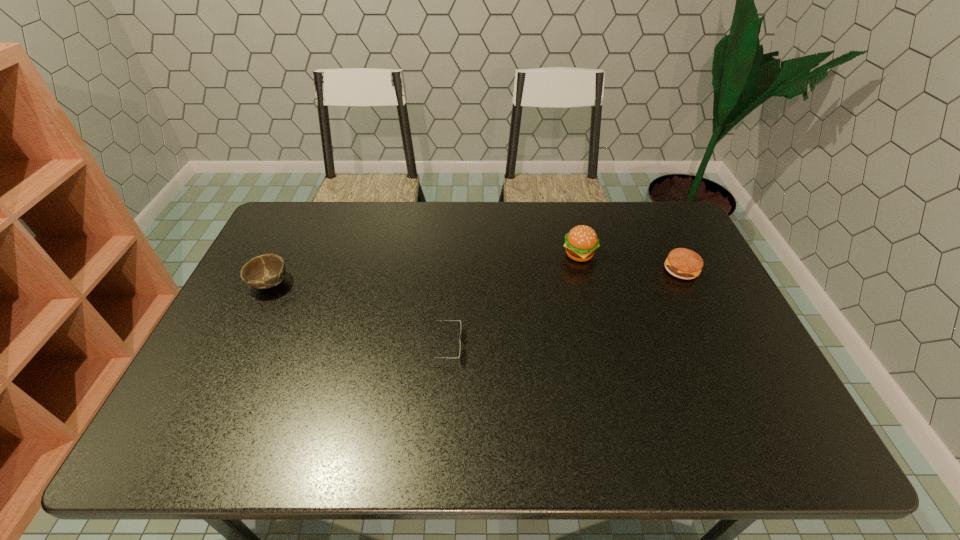
I want to click on the third object from left to right, so click(x=581, y=242).

I want to click on the left hamburger, so click(581, 242).

Identify the location of bowl. This screenshot has width=960, height=540. (265, 271).

Where is `the right hamburger`? the right hamburger is located at coordinates (682, 263).

Where is `the shorter hamburger`? The width and height of the screenshot is (960, 540). the shorter hamburger is located at coordinates (682, 263).

Locate an element on the screen. This screenshot has width=960, height=540. sunglasses is located at coordinates (432, 320).

The width and height of the screenshot is (960, 540). In order to click on the nearest object in this screenshot , I will do `click(432, 320)`.

The height and width of the screenshot is (540, 960). Find the location of `vacant position located 0.240m on the front of the left hamburger`. vacant position located 0.240m on the front of the left hamburger is located at coordinates (597, 327).

Where is `free space located on the right of the leftmost object`? The height and width of the screenshot is (540, 960). free space located on the right of the leftmost object is located at coordinates (407, 284).

Identify the location of free region located on the back of the rightmost object. (656, 217).